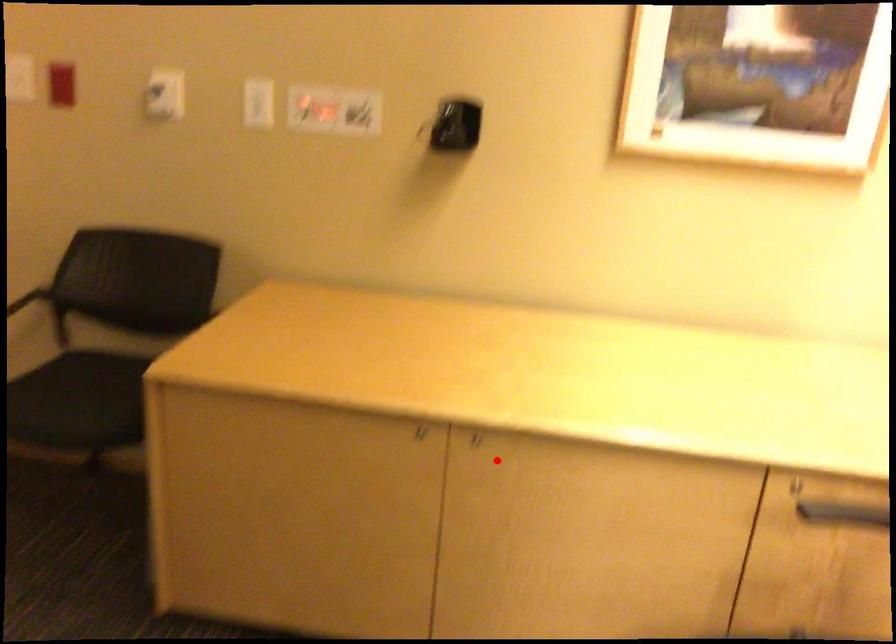
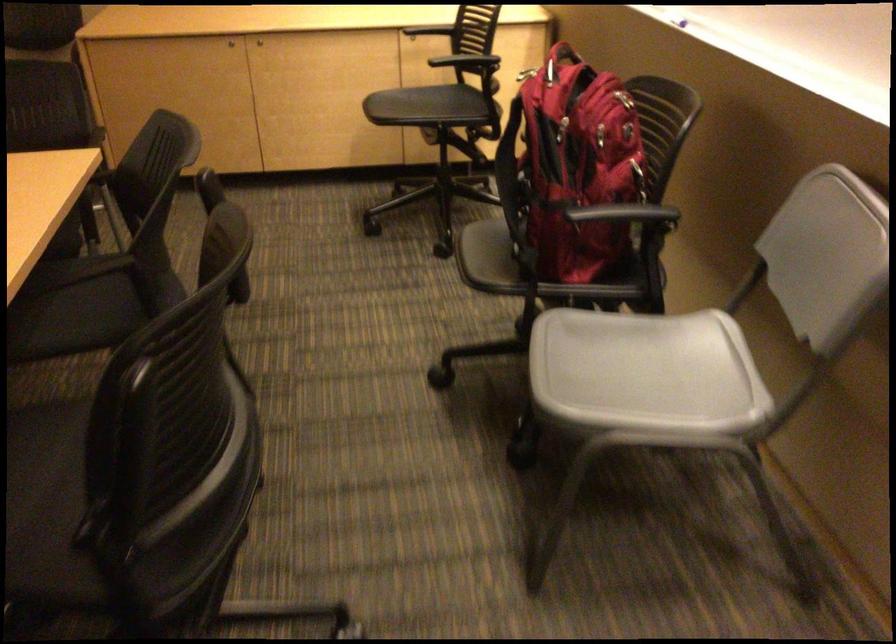
Question: I am providing you with two images of the same scene from different viewpoints. A red point is marked on the first image. Is the red point's position out of view in image 2?

Choices:
 (A) Yes
 (B) No

Answer: (B)